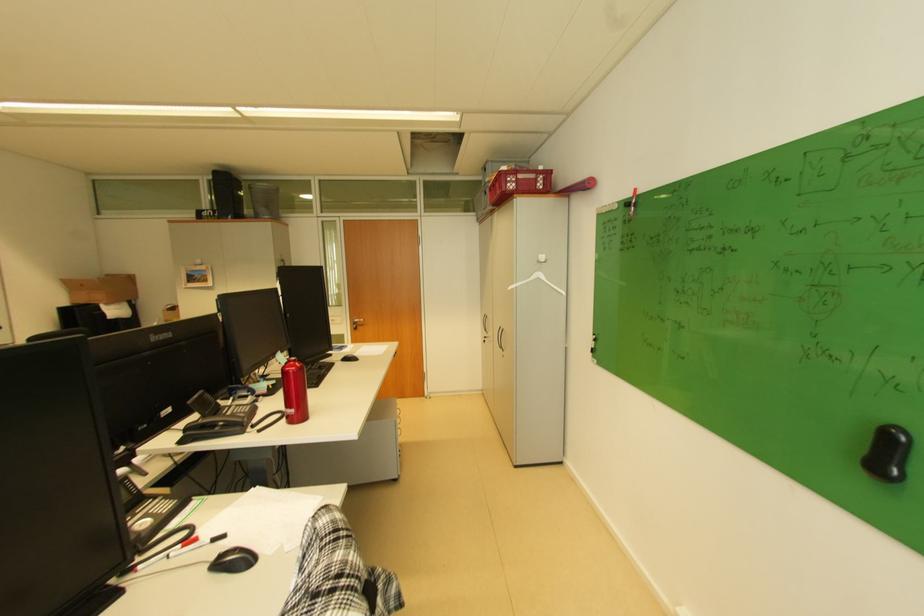
Find where to grasp the black whiteboard eraser. Please return your answer as a coordinate pair (x, y).

(888, 454)